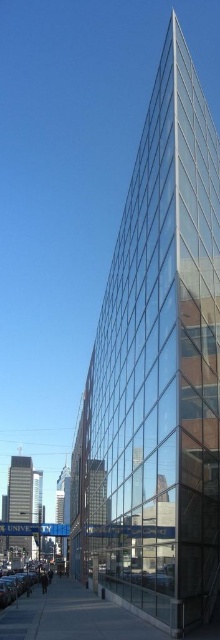
Question: Is concrete sidewalk at lower center smaller than shiny silver car at lower left?

Choices:
 (A) yes
 (B) no

Answer: (A)

Question: Does concrete sidewalk at lower center have a lesser width compared to shiny silver car at lower left?

Choices:
 (A) no
 (B) yes

Answer: (A)

Question: Which object is closer to the camera taking this photo?

Choices:
 (A) concrete sidewalk at lower center
 (B) shiny silver car at lower left

Answer: (A)

Question: Is concrete sidewalk at lower center to the left of shiny silver car at lower left from the viewer's perspective?

Choices:
 (A) no
 (B) yes

Answer: (A)